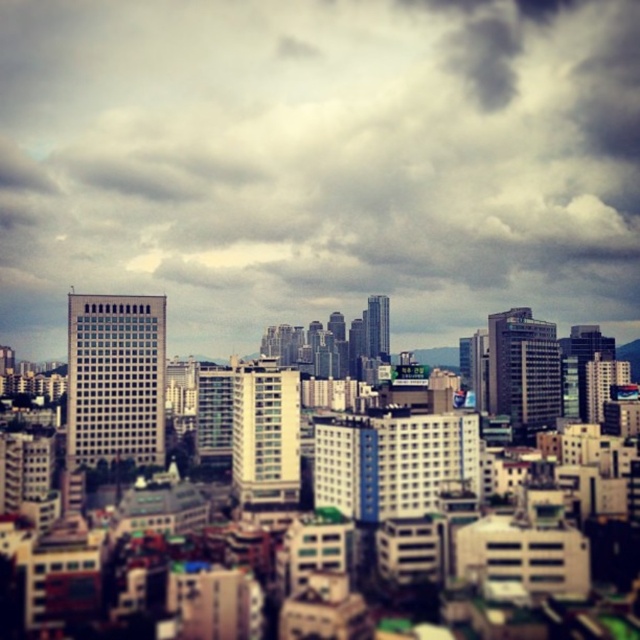
You are an architect analyzing the cityscape. You notice the cloudy sky at upper center and the white glass building at center. Which one has a greater horizontal extent in the image?

The cloudy sky at upper center might be wider than the white glass building at center according to the description.

You are an architect analyzing the city layout. You observe the cloudy sky at upper center and the white glass building at center. Which object is located to the left of the other?

The cloudy sky at upper center is positioned on the left side of white glass building at center.

You are an architect analyzing the city layout. You notice the cloudy sky at upper center and the white glass building at center. Which object is closer to the viewer?

The cloudy sky at upper center is closer to the viewer than the white glass building at center because the white glass building at center is positioned behind the cloudy sky at upper center.